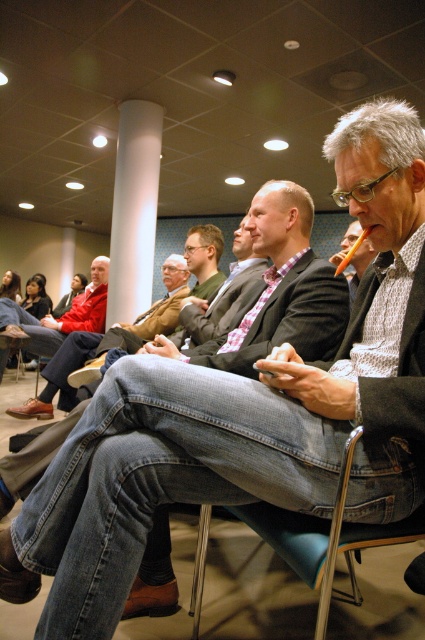
Question: Among these points, which one is nearest to the camera?

Choices:
 (A) (370, 253)
 (B) (300, 520)
 (C) (73, 392)
 (D) (81, 310)

Answer: (B)

Question: In this image, where is denim jeans at center located relative to red jacket at center?

Choices:
 (A) below
 (B) above

Answer: (A)

Question: Based on their relative distances, which object is farther from the denim jeans at center?

Choices:
 (A) red jacket at center
 (B) matte black jacket at center

Answer: (B)

Question: Based on their relative distances, which object is nearer to the metallic blue chair at lower center?

Choices:
 (A) red jacket at center
 (B) matte black jacket at center

Answer: (B)

Question: Is metallic blue chair at lower center closer to the viewer compared to red jacket at center?

Choices:
 (A) yes
 (B) no

Answer: (A)

Question: Can you confirm if metallic blue chair at lower center is smaller than red jacket at center?

Choices:
 (A) yes
 (B) no

Answer: (A)